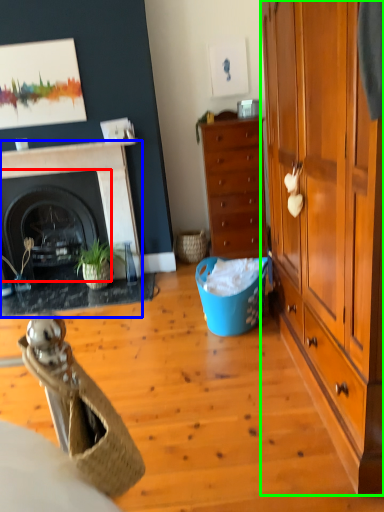
Question: Based on their relative distances, which object is nearer to fireplace (highlighted by a red box)? Choose from fireplace (highlighted by a blue box) and cabinetry (highlighted by a green box).

Choices:
 (A) fireplace
 (B) cabinetry

Answer: (A)